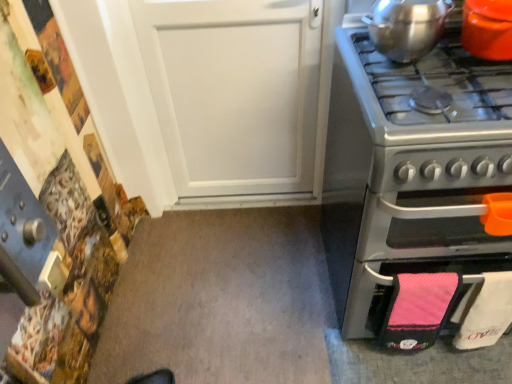
What are the coordinates of `vacant space in front of shiny metallic pot at upper right, positioned as the 2th kitchen appliance in right-to-left order` in the screenshot? It's located at (416, 84).